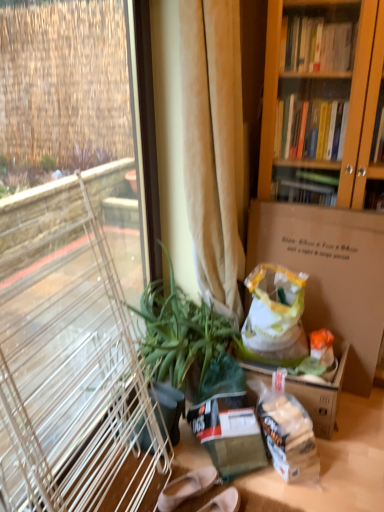
Question: Considering the positions of beige fabric curtain at center and brown cardboard box at center-right in the image, is beige fabric curtain at center bigger or smaller than brown cardboard box at center-right?

Choices:
 (A) big
 (B) small

Answer: (A)

Question: Is beige fabric curtain at center to the left or to the right of brown cardboard box at center-right in the image?

Choices:
 (A) right
 (B) left

Answer: (B)

Question: Which object is the closest to the green matte plant at left?

Choices:
 (A) clear glass window at left
 (B) beige fabric curtain at center
 (C) brown cardboard box at center-right
 (D) matte beige shoes at lower center

Answer: (B)

Question: Which object is positioned closest to the beige fabric curtain at center?

Choices:
 (A) brown cardboard box at center-right
 (B) green matte plant at left
 (C) clear glass window at left
 (D) matte beige shoes at lower center

Answer: (B)